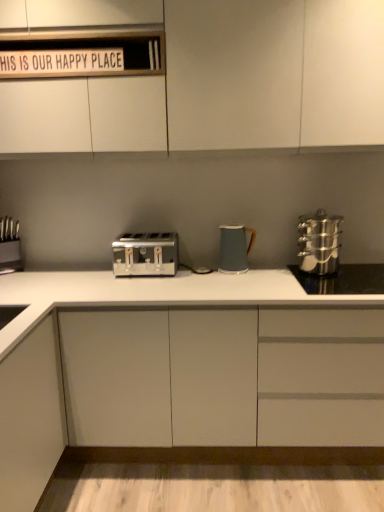
Question: Is stainless steel steamer at right aimed at satin silver toaster at center?

Choices:
 (A) no
 (B) yes

Answer: (A)

Question: Can you confirm if stainless steel steamer at right is positioned to the left of satin silver toaster at center?

Choices:
 (A) yes
 (B) no

Answer: (B)

Question: Is stainless steel steamer at right not within satin silver toaster at center?

Choices:
 (A) no
 (B) yes

Answer: (B)

Question: From a real-world perspective, is stainless steel steamer at right on top of satin silver toaster at center?

Choices:
 (A) yes
 (B) no

Answer: (A)

Question: Considering the relative sizes of stainless steel steamer at right and satin silver toaster at center in the image provided, is stainless steel steamer at right bigger than satin silver toaster at center?

Choices:
 (A) yes
 (B) no

Answer: (A)

Question: From a real-world perspective, relative to satin silver toaster at center, is white matte cabinet at center, the second cabinetry from the top, vertically above or below?

Choices:
 (A) below
 (B) above

Answer: (A)

Question: Would you say white matte cabinet at center, placed as the first cabinetry when sorted from bottom to top, is to the left or to the right of satin silver toaster at center in the picture?

Choices:
 (A) left
 (B) right

Answer: (B)

Question: Is white matte cabinet at center, placed as the first cabinetry when sorted from bottom to top, spatially inside satin silver toaster at center, or outside of it?

Choices:
 (A) inside
 (B) outside

Answer: (B)

Question: Is white matte cabinet at center, placed as the first cabinetry when sorted from bottom to top, in front of or behind satin silver toaster at center in the image?

Choices:
 (A) behind
 (B) front

Answer: (B)

Question: From the image's perspective, is stainless steel steamer at right positioned above or below satin silver toaster at center?

Choices:
 (A) above
 (B) below

Answer: (A)

Question: Is stainless steel steamer at right bigger or smaller than satin silver toaster at center?

Choices:
 (A) small
 (B) big

Answer: (B)

Question: Considering their positions, is stainless steel steamer at right located in front of or behind satin silver toaster at center?

Choices:
 (A) front
 (B) behind

Answer: (A)

Question: Considering the relative positions of stainless steel steamer at right and satin silver toaster at center in the image provided, is stainless steel steamer at right to the left or to the right of satin silver toaster at center?

Choices:
 (A) right
 (B) left

Answer: (A)

Question: Is white wood sign at upper center bigger or smaller than white matte cabinet at center, the second cabinetry from the top?

Choices:
 (A) big
 (B) small

Answer: (B)

Question: Choose the correct answer: Is white wood sign at upper center inside white matte cabinet at center, placed as the first cabinetry when sorted from bottom to top, or outside it?

Choices:
 (A) inside
 (B) outside

Answer: (B)